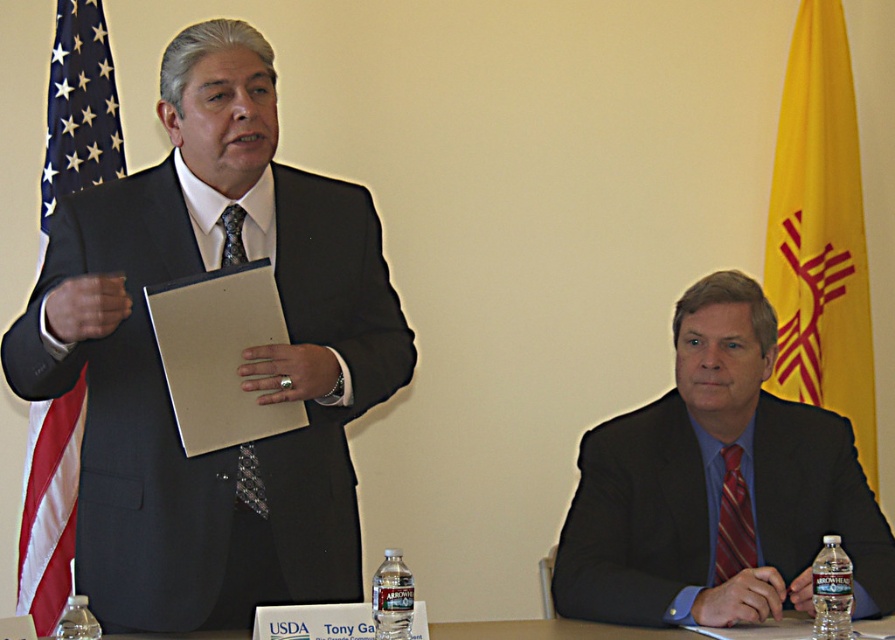
Question: Can you confirm if matte black suit at right is positioned below black textured tie at left?

Choices:
 (A) yes
 (B) no

Answer: (A)

Question: Among these objects, which one is farthest from the camera?

Choices:
 (A) yellow fabric flag at upper right
 (B) black textured tie at left

Answer: (A)

Question: Does yellow fabric flag at upper right appear under striped silk tie at right?

Choices:
 (A) no
 (B) yes

Answer: (A)

Question: Which point is closer to the camera?

Choices:
 (A) (237, 204)
 (B) (729, 573)
 (C) (252, 586)

Answer: (C)

Question: Does striped silk tie at right lie behind black textured tie at left?

Choices:
 (A) yes
 (B) no

Answer: (A)

Question: Which point appears farthest from the camera in this image?

Choices:
 (A) (777, 278)
 (B) (666, 508)
 (C) (731, 564)

Answer: (A)